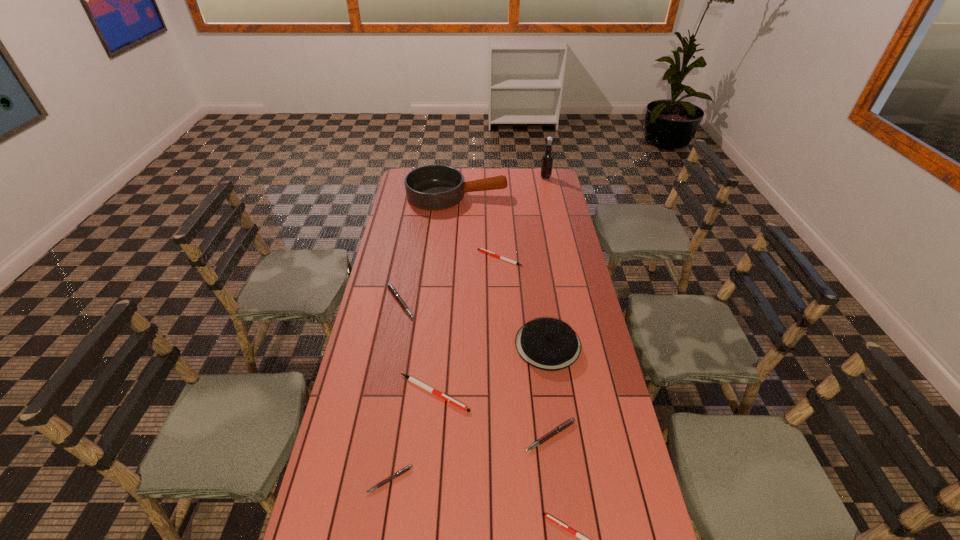
Identify the location of vacant space situated at the nib of the farthest pink pen. The width and height of the screenshot is (960, 540). (497, 302).

What are the coordinates of `free space located 0.350m on the clicker of the second nearest white pen` in the screenshot? It's located at (581, 393).

The width and height of the screenshot is (960, 540). Identify the location of vacant point located 0.160m at the nib of the fourth farthest pen. (561, 512).

Find the location of a particular element. vacant space located 0.350m on the clicker of the seventh nearest object is located at coordinates (396, 258).

The image size is (960, 540). What are the coordinates of `vacant region located 0.400m on the clicker of the seventh nearest object` in the screenshot? It's located at (385, 258).

Where is `free space located on the clicker of the seventh nearest object`? The image size is (960, 540). free space located on the clicker of the seventh nearest object is located at coordinates (385, 258).

Locate an element on the screen. vacant point located at the nib of the second nearest pen is located at coordinates (383, 523).

Identify the location of root beer positioned at the far edge. (547, 160).

Where is `pan that is positioned at the far edge`? The image size is (960, 540). pan that is positioned at the far edge is located at coordinates (432, 187).

What are the coordinates of `pan located in the left edge section of the desktop` in the screenshot? It's located at (432, 187).